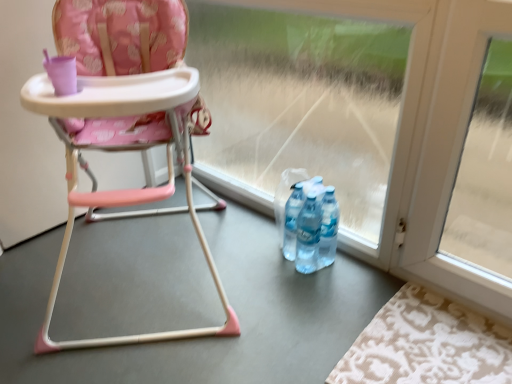
Question: Considering the positions of beige damask rug at lower right and matte plastic highchair at center in the image, is beige damask rug at lower right bigger or smaller than matte plastic highchair at center?

Choices:
 (A) big
 (B) small

Answer: (B)

Question: From the image's perspective, is beige damask rug at lower right above or below matte plastic highchair at center?

Choices:
 (A) below
 (B) above

Answer: (A)

Question: Estimate the real-world distances between objects in this image. Which object is farther from the beige damask rug at lower right?

Choices:
 (A) matte plastic highchair at center
 (B) transparent glass door at center

Answer: (A)

Question: Estimate the real-world distances between objects in this image. Which object is closer to the transparent glass door at center?

Choices:
 (A) beige damask rug at lower right
 (B) matte plastic highchair at center

Answer: (B)